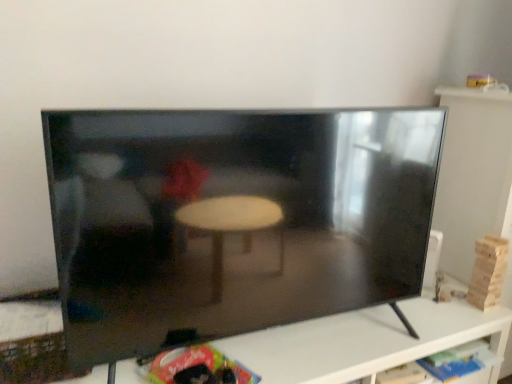
Question: Is black glossy tv at center taller than black glossy tv at center?

Choices:
 (A) no
 (B) yes

Answer: (A)

Question: Considering the relative sizes of black glossy tv at center and black glossy tv at center in the image provided, is black glossy tv at center smaller than black glossy tv at center?

Choices:
 (A) yes
 (B) no

Answer: (B)

Question: Is the position of black glossy tv at center more distant than that of black glossy tv at center?

Choices:
 (A) yes
 (B) no

Answer: (A)

Question: Is black glossy tv at center at the left side of black glossy tv at center?

Choices:
 (A) no
 (B) yes

Answer: (A)

Question: Is black glossy tv at center wider than black glossy tv at center?

Choices:
 (A) no
 (B) yes

Answer: (B)

Question: Is black glossy tv at center facing towards black glossy tv at center?

Choices:
 (A) no
 (B) yes

Answer: (A)

Question: Could black glossy tv at center be considered to be inside black glossy tv at center?

Choices:
 (A) yes
 (B) no

Answer: (B)

Question: Is black glossy tv at center further to the viewer compared to black glossy tv at center?

Choices:
 (A) yes
 (B) no

Answer: (B)

Question: Is black glossy tv at center wider than black glossy tv at center?

Choices:
 (A) no
 (B) yes

Answer: (A)

Question: Considering the relative sizes of black glossy tv at center and black glossy tv at center in the image provided, is black glossy tv at center taller than black glossy tv at center?

Choices:
 (A) yes
 (B) no

Answer: (A)

Question: From a real-world perspective, is black glossy tv at center on black glossy tv at center?

Choices:
 (A) no
 (B) yes

Answer: (B)

Question: Does black glossy tv at center have a smaller size compared to black glossy tv at center?

Choices:
 (A) no
 (B) yes

Answer: (B)

Question: Is black glossy tv at center wider or thinner than black glossy tv at center?

Choices:
 (A) wide
 (B) thin

Answer: (B)